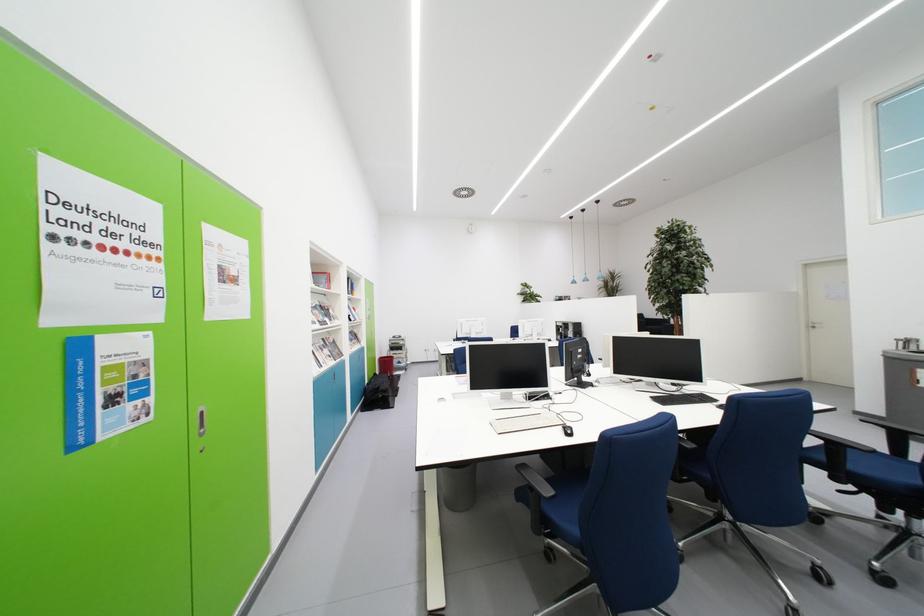
You are a GUI agent. You are given a task and a screenshot of the screen. Output one action in this format:
    pyautogui.click(x=<x>, y=<y>)
    Task: Click on the book on shelf
    The width and height of the screenshot is (924, 616).
    Given the screenshot: What is the action you would take?
    (x=354, y=339)